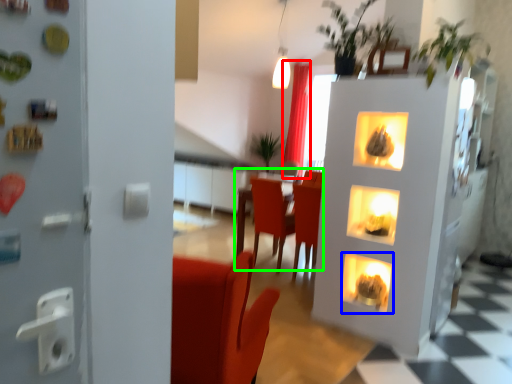
Question: Which is farther away from curtain (highlighted by a red box)? fireplace (highlighted by a blue box) or table (highlighted by a green box)?

Choices:
 (A) fireplace
 (B) table

Answer: (A)